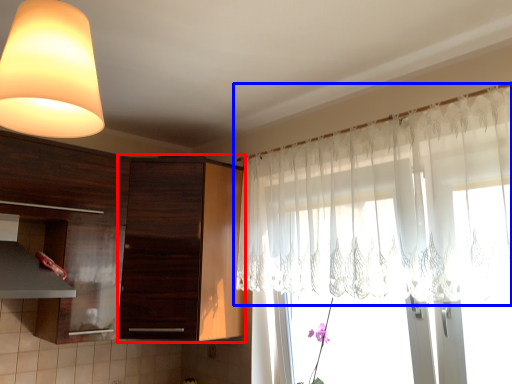
Question: Among these objects, which one is nearest to the camera, cabinetry (highlighted by a red box) or curtain (highlighted by a blue box)?

Choices:
 (A) cabinetry
 (B) curtain

Answer: (B)